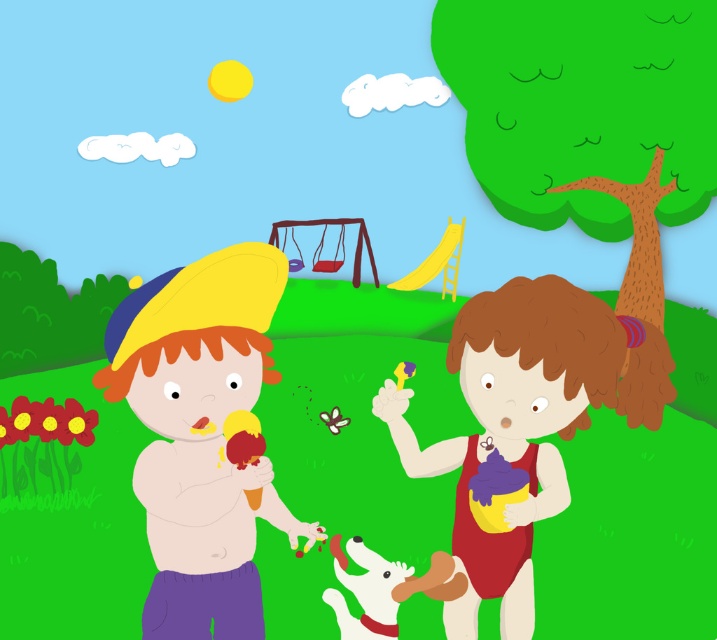
You are a photographer trying to capture a photo of both the smooth yellow hat at left and the matte yellow swimsuit at center. Which object should you zoom in on to ensure both fit in the frame without cropping?

The smooth yellow hat at left has a lesser width compared to matte yellow swimsuit at center, so you should zoom in on the matte yellow swimsuit at center to ensure both fit in the frame without cropping.

Consider the image. You are a photographer trying to capture a photo of both the smooth yellow hat at left and the matte yellow swimsuit at center. Since you want both subjects in the frame, which direction should you move your camera to include both?

The smooth yellow hat at left is to the left of the matte yellow swimsuit at center. To include both in the frame, move the camera to the left.

From the picture: You are a photographer standing in the park and want to take a photo of the smooth yellow hat at left and the matte yellow swimsuit at center. Which object will appear larger in the photo?

The smooth yellow hat at left appears larger in the photo because it is closer to the viewer than the matte yellow swimsuit at center.